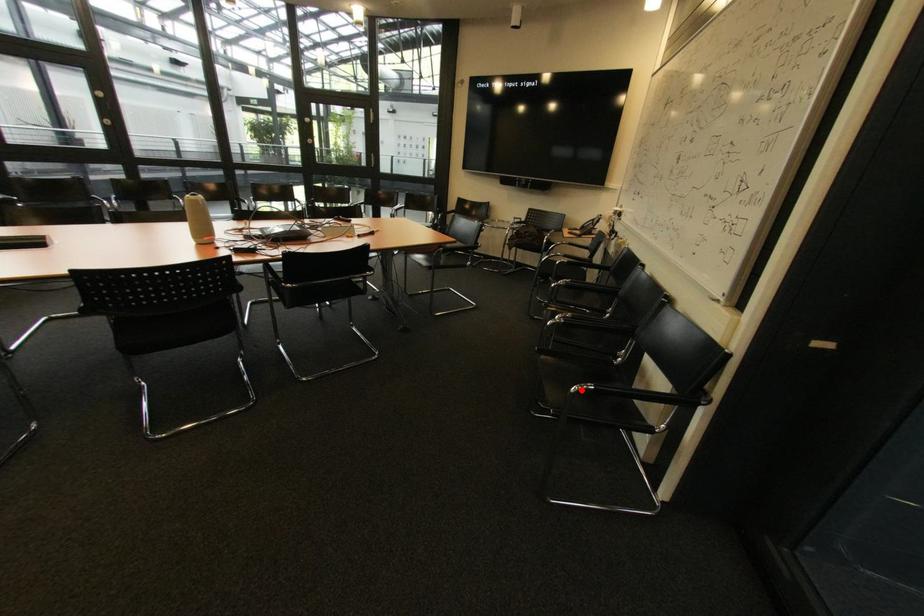
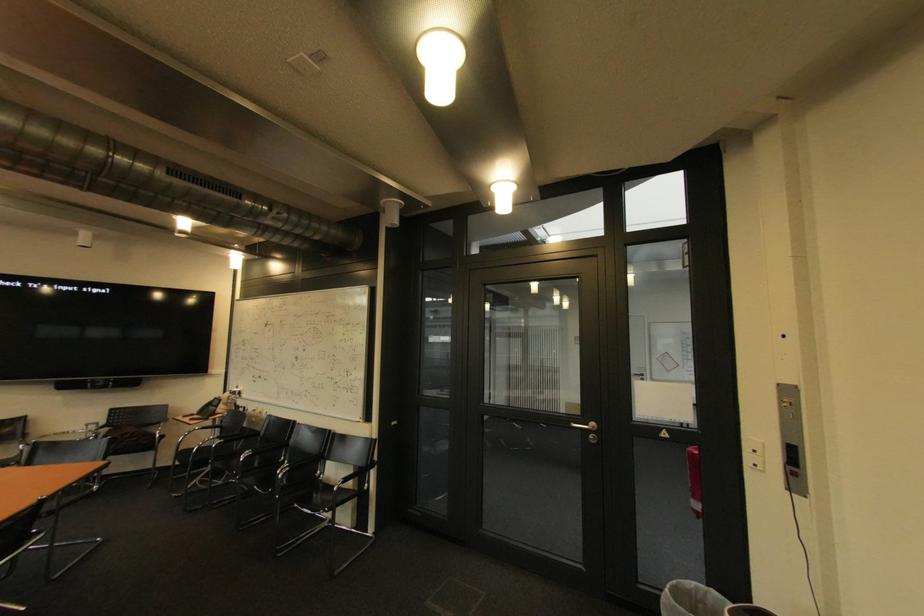
The point at the highlighted location is marked in the first image. Where is the corresponding point in the second image?

(343, 488)